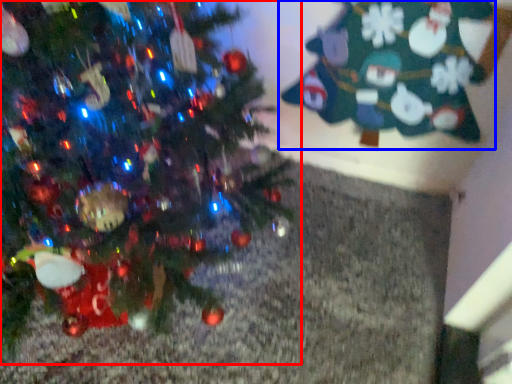
Question: Which object appears farthest to the camera in this image, christmas tree (highlighted by a red box) or christmas tree (highlighted by a blue box)?

Choices:
 (A) christmas tree
 (B) christmas tree

Answer: (B)